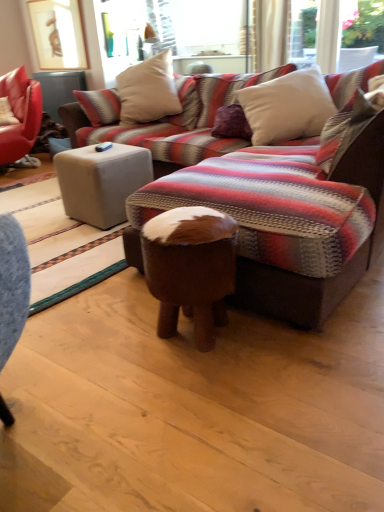
Question: From a real-world perspective, is beige fabric pillow at upper center, which is the 3th pillow in front-to-back order, on white soft pillow at upper center, the second pillow from the front?

Choices:
 (A) yes
 (B) no

Answer: (A)

Question: Is beige fabric pillow at upper center, which is the first pillow in back-to-front order, shorter than white soft pillow at upper center, marked as the second pillow in a back-to-front arrangement?

Choices:
 (A) yes
 (B) no

Answer: (B)

Question: Is the depth of beige fabric pillow at upper center, which is the first pillow in back-to-front order, greater than that of white soft pillow at upper center, the second pillow from the front?

Choices:
 (A) yes
 (B) no

Answer: (A)

Question: Is beige fabric pillow at upper center, which is the 3th pillow in front-to-back order, to the left of white soft pillow at upper center, the second pillow from the front, from the viewer's perspective?

Choices:
 (A) no
 (B) yes

Answer: (B)

Question: Is beige fabric pillow at upper center, which is the first pillow in back-to-front order, completely or partially outside of white soft pillow at upper center, the second pillow from the front?

Choices:
 (A) yes
 (B) no

Answer: (A)

Question: Considering the positions of matte white ottoman at center, acting as the first table starting from the top, and beige fabric ottoman at center, which is the 1th table in right-to-left order, in the image, is matte white ottoman at center, acting as the first table starting from the top, bigger or smaller than beige fabric ottoman at center, which is the 1th table in right-to-left order,?

Choices:
 (A) big
 (B) small

Answer: (B)

Question: Is matte white ottoman at center, the first table from the left, to the left or to the right of beige fabric ottoman at center, which appears as the 2th table when viewed from the back, in the image?

Choices:
 (A) right
 (B) left

Answer: (B)

Question: Is matte white ottoman at center, the 2th table when ordered from front to back, in front of or behind beige fabric ottoman at center, the second table in the left-to-right sequence, in the image?

Choices:
 (A) front
 (B) behind

Answer: (B)

Question: From a real-world perspective, is matte white ottoman at center, the second table from the bottom, physically located above or below beige fabric ottoman at center, acting as the 1th table starting from the front?

Choices:
 (A) below
 (B) above

Answer: (B)

Question: Considering their positions, is brown leather stool at center located in front of or behind matte white ottoman at center, acting as the first table starting from the top?

Choices:
 (A) behind
 (B) front

Answer: (B)

Question: Based on their positions, is brown leather stool at center located to the left or right of matte white ottoman at center, the first table from the left?

Choices:
 (A) right
 (B) left

Answer: (A)

Question: From the image's perspective, is brown leather stool at center above or below matte white ottoman at center, the first table positioned from the back?

Choices:
 (A) below
 (B) above

Answer: (A)

Question: In terms of size, does brown leather stool at center appear bigger or smaller than matte white ottoman at center, the first table from the left?

Choices:
 (A) small
 (B) big

Answer: (A)

Question: Considering their positions, is matte white ottoman at center, the 2th table when ordered from front to back, located in front of or behind white soft pillow at upper right, which is the 1th pillow in front-to-back order?

Choices:
 (A) front
 (B) behind

Answer: (B)

Question: Is matte white ottoman at center, the 2th table when ordered from front to back, to the left or to the right of white soft pillow at upper right, the third pillow viewed from the back, in the image?

Choices:
 (A) left
 (B) right

Answer: (A)